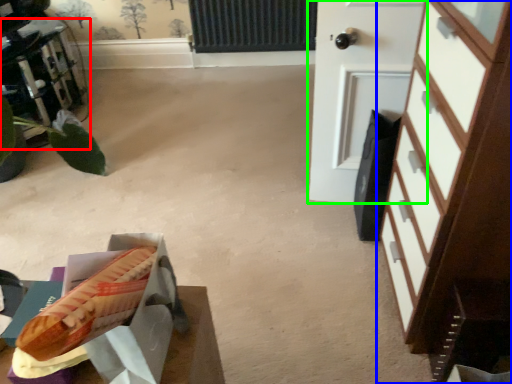
Question: Which object is the closest to the furniture (highlighted by a red box)? Choose among these: chest of drawers (highlighted by a blue box) or door (highlighted by a green box).

Choices:
 (A) chest of drawers
 (B) door

Answer: (B)